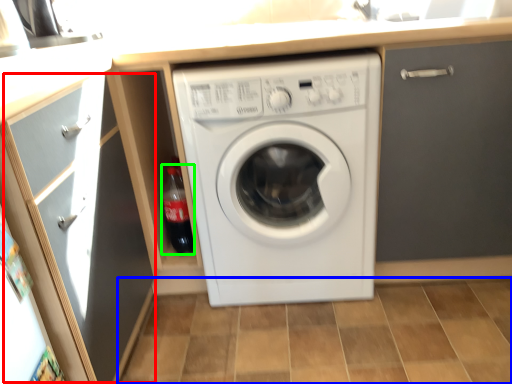
Question: Based on their relative distances, which object is farther from glass door (highlighted by a red box)? Choose from tile (highlighted by a blue box) and bottle (highlighted by a green box).

Choices:
 (A) tile
 (B) bottle

Answer: (A)